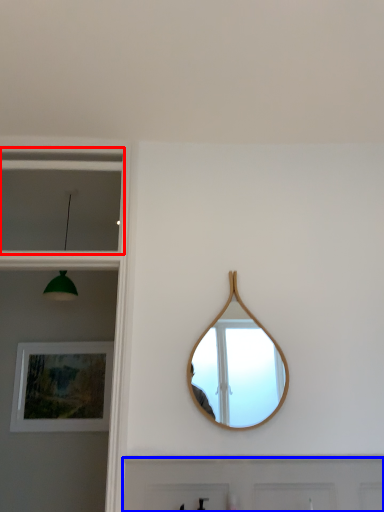
Question: Among these objects, which one is farthest to the camera, window (highlighted by a red box) or door (highlighted by a blue box)?

Choices:
 (A) window
 (B) door

Answer: (A)